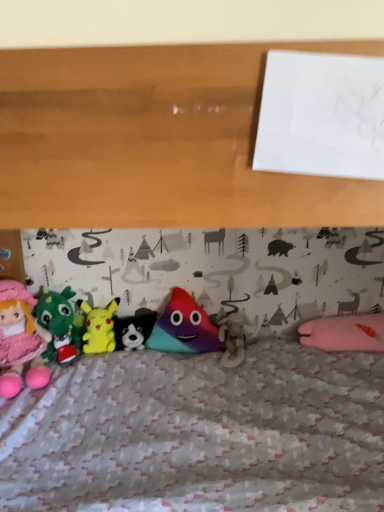
Question: Is multicolored plush toy at center, which is the second toy from right to left, next to fluffy white teddy bear at center, the 1th toy when ordered from right to left?

Choices:
 (A) no
 (B) yes

Answer: (A)

Question: Is multicolored plush toy at center, which is the second toy from right to left, shorter than fluffy white teddy bear at center, which ranks as the 6th toy in left-to-right order?

Choices:
 (A) no
 (B) yes

Answer: (A)

Question: Considering the relative sizes of multicolored plush toy at center, which is the second toy from right to left, and fluffy white teddy bear at center, which ranks as the 6th toy in left-to-right order, in the image provided, is multicolored plush toy at center, which is the second toy from right to left, taller than fluffy white teddy bear at center, which ranks as the 6th toy in left-to-right order,?

Choices:
 (A) yes
 (B) no

Answer: (A)

Question: From the image's perspective, is multicolored plush toy at center, which is the second toy from right to left, above fluffy white teddy bear at center, which ranks as the 6th toy in left-to-right order?

Choices:
 (A) no
 (B) yes

Answer: (B)

Question: From a real-world perspective, is multicolored plush toy at center, which is the second toy from right to left, located beneath fluffy white teddy bear at center, the 1th toy when ordered from right to left?

Choices:
 (A) yes
 (B) no

Answer: (B)

Question: Is multicolored plush toy at center, which is the second toy from right to left, outside fluffy white teddy bear at center, the 1th toy when ordered from right to left?

Choices:
 (A) no
 (B) yes

Answer: (B)

Question: Is velvet green dragon at left, the 5th toy in the right-to-left sequence, beside white plush dog at center, arranged as the third toy when viewed from the right?

Choices:
 (A) no
 (B) yes

Answer: (A)

Question: Does velvet green dragon at left, which appears as the 2th toy when viewed from the left, have a smaller size compared to white plush dog at center, arranged as the third toy when viewed from the right?

Choices:
 (A) no
 (B) yes

Answer: (A)

Question: Can you confirm if velvet green dragon at left, the 5th toy in the right-to-left sequence, is taller than white plush dog at center, marked as the fourth toy in a left-to-right arrangement?

Choices:
 (A) yes
 (B) no

Answer: (A)

Question: Is velvet green dragon at left, the 5th toy in the right-to-left sequence, bigger than white plush dog at center, marked as the fourth toy in a left-to-right arrangement?

Choices:
 (A) yes
 (B) no

Answer: (A)

Question: From a real-world perspective, is velvet green dragon at left, which appears as the 2th toy when viewed from the left, positioned under white plush dog at center, arranged as the third toy when viewed from the right, based on gravity?

Choices:
 (A) yes
 (B) no

Answer: (B)

Question: Is velvet green dragon at left, which appears as the 2th toy when viewed from the left, facing away from white plush dog at center, arranged as the third toy when viewed from the right?

Choices:
 (A) yes
 (B) no

Answer: (B)

Question: Can you confirm if matte pink plush doll at left, which is counted as the first toy, starting from the left, is smaller than fluffy white teddy bear at center, which ranks as the 6th toy in left-to-right order?

Choices:
 (A) no
 (B) yes

Answer: (A)